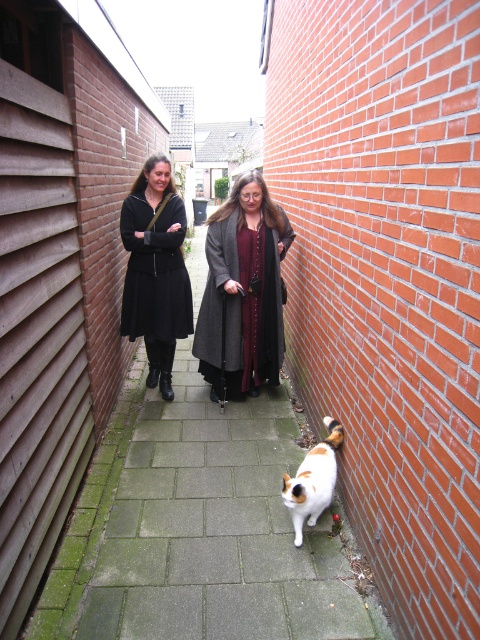
Question: Considering the real-world distances, which object is closest to the matte black dress at center?

Choices:
 (A) white fur cat at center
 (B) dark gray wool coat at center

Answer: (B)

Question: Is matte black dress at center above white fur cat at center?

Choices:
 (A) no
 (B) yes

Answer: (B)

Question: Can you confirm if matte black dress at center is smaller than white fur cat at center?

Choices:
 (A) yes
 (B) no

Answer: (B)

Question: Can you confirm if matte black dress at center is bigger than white fur cat at center?

Choices:
 (A) yes
 (B) no

Answer: (A)

Question: Among these objects, which one is nearest to the camera?

Choices:
 (A) matte black dress at center
 (B) white fur cat at center
 (C) dark gray wool coat at center

Answer: (B)

Question: Among these objects, which one is farthest from the camera?

Choices:
 (A) white fur cat at center
 (B) matte black dress at center
 (C) dark gray wool coat at center

Answer: (B)